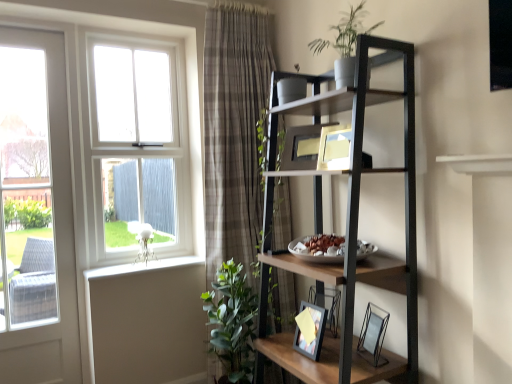
Question: Based on their positions, is metallic black shelf at upper right located to the left or right of plaid fabric curtain at center?

Choices:
 (A) left
 (B) right

Answer: (B)

Question: From a real-world perspective, is metallic black shelf at upper right positioned above or below plaid fabric curtain at center?

Choices:
 (A) below
 (B) above

Answer: (A)

Question: Estimate the real-world distances between objects in this image. Which object is closer to the plaid fabric curtain at center?

Choices:
 (A) metallic black shelf at upper right
 (B) white glossy door at left
 (C) white wood window at upper left
 (D) clear glass picture frame at lower right, positioned as the first picture frame in front-to-back order
 (E) green leafy plant at lower left

Answer: (E)

Question: Considering the real-world distances, which object is farthest from the plaid fabric curtain at center?

Choices:
 (A) white glossy door at left
 (B) white wood window at upper left
 (C) white painted wood at lower left
 (D) green leafy plant at lower left
 (E) green matte plant at upper center

Answer: (A)